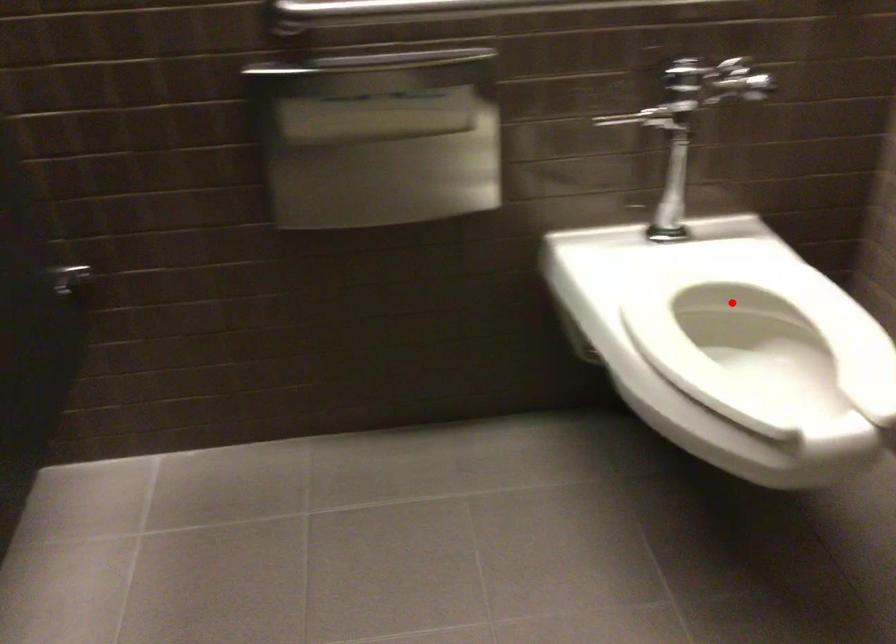
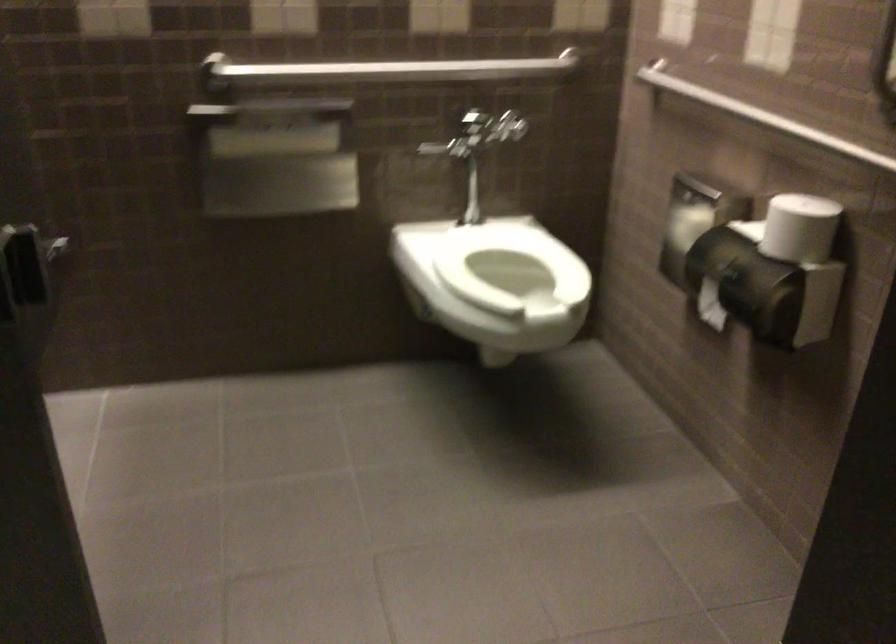
Question: I am providing you with two images of the same scene from different viewpoints. A red point is shown in image1. For the corresponding object point in image2, is it positioned nearer or farther from the camera?

Choices:
 (A) Nearer
 (B) Farther

Answer: (B)